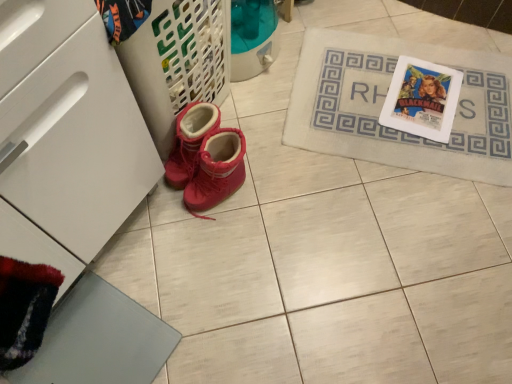
Question: Looking at their shapes, would you say white matte drawer at lower left is wider or thinner than suede-like red boots at lower left?

Choices:
 (A) wide
 (B) thin

Answer: (A)

Question: Based on their positions, is white matte drawer at lower left located to the left or right of suede-like red boots at lower left?

Choices:
 (A) left
 (B) right

Answer: (A)

Question: Considering the real-world distances, which object is closest to the beige fabric bath mat at upper right?

Choices:
 (A) white matte drawer at lower left
 (B) suede-like red boots at lower left

Answer: (B)

Question: Based on their relative distances, which object is nearer to the beige fabric bath mat at upper right?

Choices:
 (A) suede-like red boots at lower left
 (B) white matte drawer at lower left

Answer: (A)